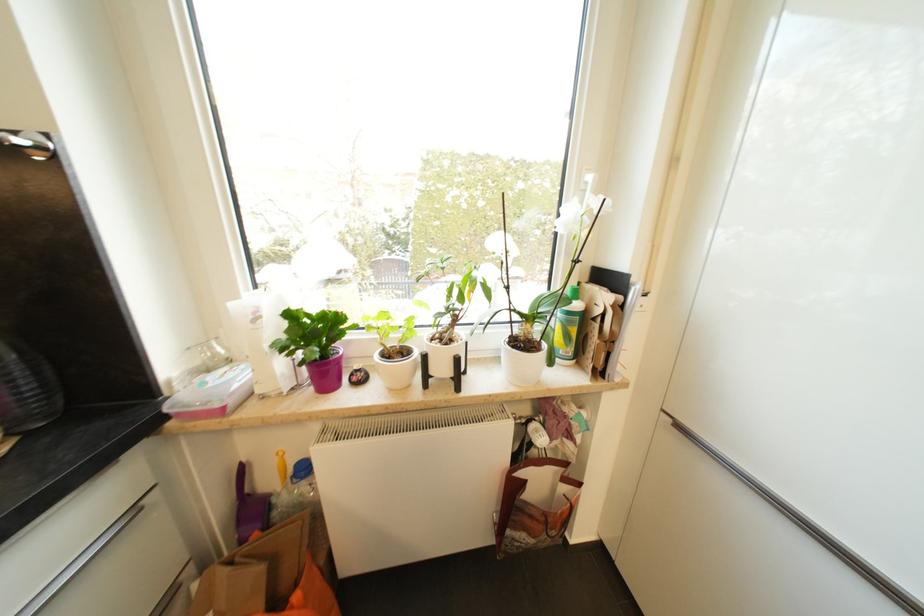
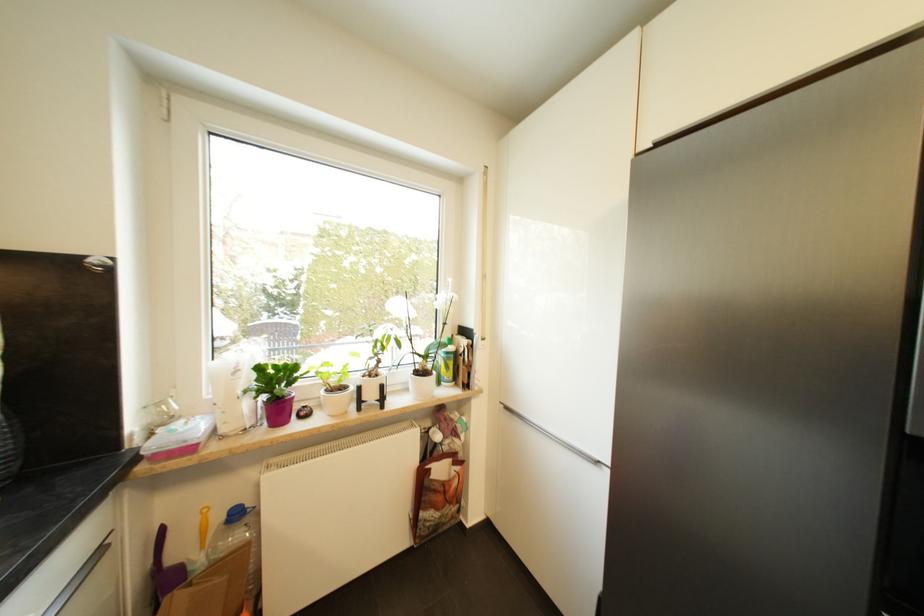
Locate, in the second image, the point that corresponds to pixel 138 514 in the first image.

(105, 553)